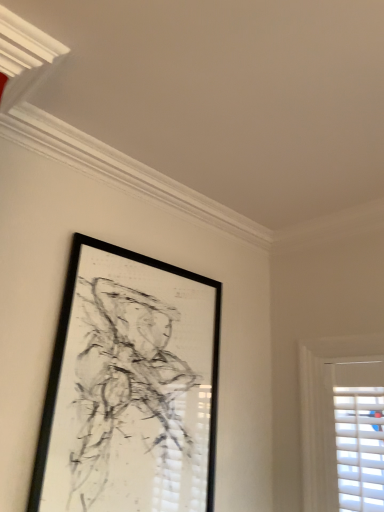
Locate an element on the screen. The image size is (384, 512). black matte picture frame at upper center is located at coordinates (130, 387).

What do you see at coordinates (130, 387) in the screenshot? Image resolution: width=384 pixels, height=512 pixels. I see `black matte picture frame at upper center` at bounding box center [130, 387].

You are a GUI agent. You are given a task and a screenshot of the screen. Output one action in this format:
    pyautogui.click(x=<x>, y=<y>)
    Task: Click on the black matte picture frame at upper center
    The width and height of the screenshot is (384, 512).
    Given the screenshot: What is the action you would take?
    pyautogui.click(x=130, y=387)